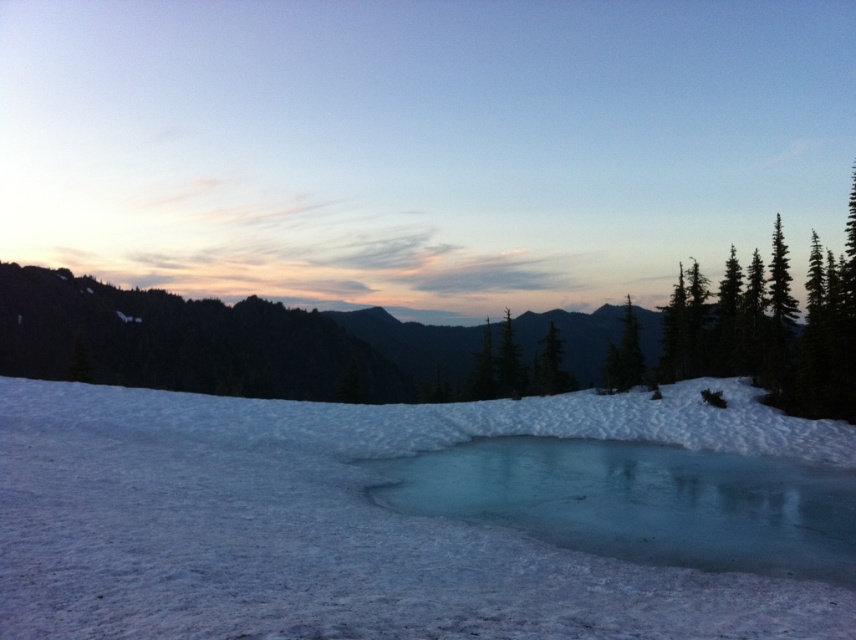
Can you confirm if translucent ice at center is positioned below green matte tree at center?

Yes.

Does point (681, 474) come closer to viewer compared to point (539, 369)?

Yes, point (681, 474) is closer to viewer.

I want to click on translucent ice at center, so click(x=639, y=500).

Is white snow at center above translucent ice at center?

Correct, white snow at center is located above translucent ice at center.

Where is `white snow at center`? This screenshot has height=640, width=856. white snow at center is located at coordinates (348, 522).

What do you see at coordinates (348, 522) in the screenshot? I see `white snow at center` at bounding box center [348, 522].

The width and height of the screenshot is (856, 640). What are the coordinates of `white snow at center` in the screenshot? It's located at (348, 522).

Which is more to the left, white snow at center or green matte tree at center?

white snow at center is more to the left.

Does point (539, 588) come in front of point (554, 339)?

Yes, point (539, 588) is in front of point (554, 339).

Between point (204, 456) and point (544, 353), which one is positioned behind?

The point (544, 353) is behind.

In order to click on white snow at center in this screenshot , I will do `click(348, 522)`.